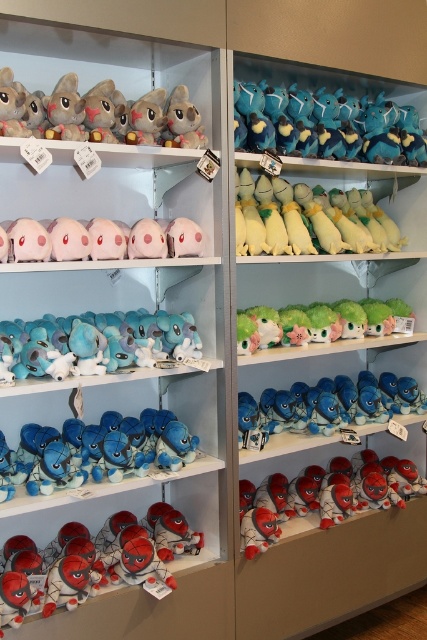
You are a customer in the store and want to place the soft plush toy at center on top of the green plush toy at center. Is this possible based on their heights?

The soft plush toy at center is shorter than the green plush toy at center, so placing the soft plush toy at center on top of the green plush toy at center is possible as it won

You are a customer in the store looking at the blue plush toy at upper center and the red plush spiderman at lower right. Which one do you see first when you walk into the store?

The blue plush toy at upper center is in front of the red plush spiderman at lower right, so you will see the blue plush toy at upper center first when you walk into the store.

You are a customer in the store and want to pick up both items at point (263, 134) and point (394, 481). Which one should you reach for first to minimize the distance walked?

You should reach for the item at point 0.211, 0.611 first because it is closer to you than the item at point (394, 481).